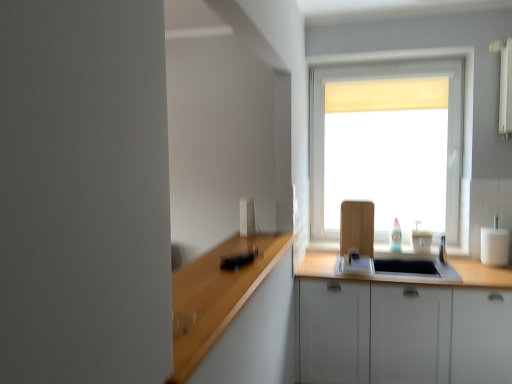
Question: Should I look upward or downward to see white matte cabinet at lower right?

Choices:
 (A) up
 (B) down

Answer: (B)

Question: Is white matte cabinet at lower right facing towards white glossy sink at center?

Choices:
 (A) no
 (B) yes

Answer: (A)

Question: Is white matte cabinet at lower right taller than white glossy sink at center?

Choices:
 (A) no
 (B) yes

Answer: (B)

Question: Does white matte cabinet at lower right have a smaller size compared to white glossy sink at center?

Choices:
 (A) yes
 (B) no

Answer: (B)

Question: Considering the relative sizes of white matte cabinet at lower right and white glossy sink at center in the image provided, is white matte cabinet at lower right bigger than white glossy sink at center?

Choices:
 (A) yes
 (B) no

Answer: (A)

Question: Is white matte cabinet at lower right wider than white glossy sink at center?

Choices:
 (A) yes
 (B) no

Answer: (A)

Question: Is white matte cabinet at lower right behind white glossy sink at center?

Choices:
 (A) no
 (B) yes

Answer: (A)

Question: Could you tell me if white matte window at center is turned towards white matte cabinet at lower right?

Choices:
 (A) yes
 (B) no

Answer: (B)

Question: Is white matte window at center to the left of white matte cabinet at lower right from the viewer's perspective?

Choices:
 (A) no
 (B) yes

Answer: (B)

Question: Is white matte window at center located outside white matte cabinet at lower right?

Choices:
 (A) no
 (B) yes

Answer: (B)

Question: From the image's perspective, is white matte window at center over white matte cabinet at lower right?

Choices:
 (A) no
 (B) yes

Answer: (B)

Question: Is white matte window at center to the right of white matte cabinet at lower right from the viewer's perspective?

Choices:
 (A) no
 (B) yes

Answer: (A)

Question: Is white matte window at center turned away from white matte cabinet at lower right?

Choices:
 (A) yes
 (B) no

Answer: (B)

Question: Can you confirm if white matte window at center is taller than white glossy toaster at upper center, placed as the 1th appliance when sorted from left to right?

Choices:
 (A) no
 (B) yes

Answer: (B)